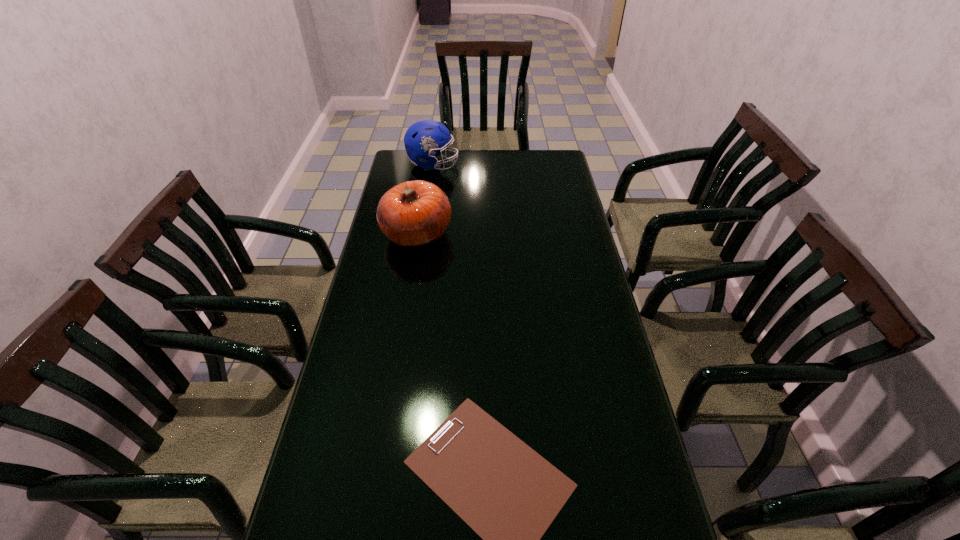
In the image, there is a desktop. Find the location of `vacant space at the right edge`. vacant space at the right edge is located at coordinates (560, 204).

This screenshot has width=960, height=540. In the image, there is a desktop. What are the coordinates of `blank space at the far left corner` in the screenshot? It's located at pos(420,170).

The height and width of the screenshot is (540, 960). Find the location of `free space at the far right corner of the desktop`. free space at the far right corner of the desktop is located at coordinates (545, 159).

Identify which object is the nearest to the football helmet. Please provide its 2D coordinates. Your answer should be formatted as a tuple, i.e. [(x, y)], where the tuple contains the x and y coordinates of a point satisfying the conditions above.

[(414, 213)]

Where is `object that is the second nearest to the nearest object`? object that is the second nearest to the nearest object is located at coordinates (421, 140).

Identify the location of free region that satisfies the following two spatial constraints: 1. on the face guard of the football helmet; 2. on the front side of the pumpkin. The image size is (960, 540). (422, 233).